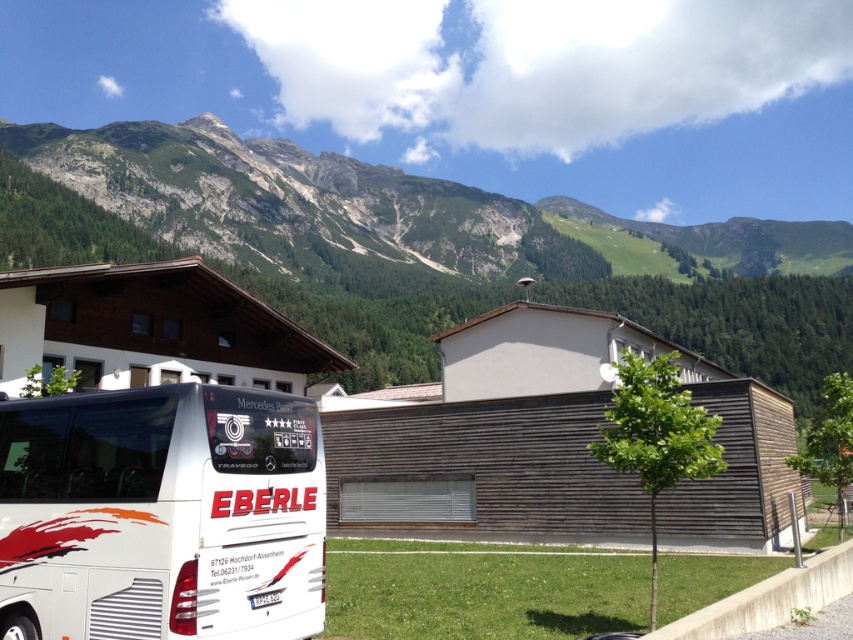
You are a tourist standing in front of the white matte bus at lower left and want to take a photo of the green rocky mountain at upper center. Can you see the entire mountain in the photo without moving your camera position?

The green rocky mountain at upper center is much taller than the white matte bus at lower left, so you might not be able to capture the entire mountain in the photo from your current position unless you have a wide enough lens.